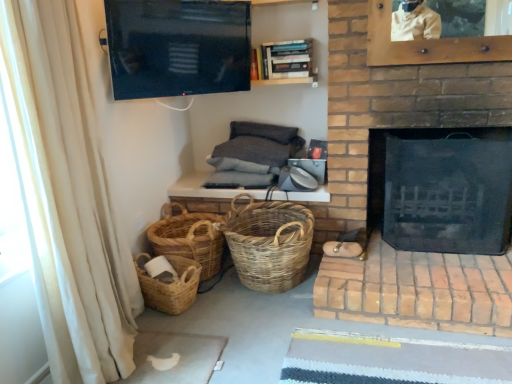
The height and width of the screenshot is (384, 512). I want to click on reddish-brown brick at right, so tap(418, 290).

This screenshot has height=384, width=512. What are the coordinates of `black mesh fireplace at right` in the screenshot? It's located at (442, 189).

This screenshot has width=512, height=384. I want to click on woven natural baskets at lower left, the second basket from the right, so click(189, 237).

Is flat-screen tv at upper center outside of woven natural baskets at lower left, marked as the second basket in a left-to-right arrangement?

Indeed, flat-screen tv at upper center is completely outside woven natural baskets at lower left, marked as the second basket in a left-to-right arrangement.

Which object is wider, flat-screen tv at upper center or woven natural baskets at lower left, marked as the second basket in a left-to-right arrangement?

woven natural baskets at lower left, marked as the second basket in a left-to-right arrangement.

Based on the photo, how far apart are flat-screen tv at upper center and woven natural baskets at lower left, the second basket from the right?

The distance of flat-screen tv at upper center from woven natural baskets at lower left, the second basket from the right, is 35.26 inches.

Who is more distant, flat-screen tv at upper center or woven natural baskets at lower left, marked as the second basket in a left-to-right arrangement?

woven natural baskets at lower left, marked as the second basket in a left-to-right arrangement.

Choose the correct answer: Is black mesh fireplace at right inside beige fabric curtain at left or outside it?

black mesh fireplace at right lies outside beige fabric curtain at left.

Does black mesh fireplace at right appear on the right side of beige fabric curtain at left?

Correct, you'll find black mesh fireplace at right to the right of beige fabric curtain at left.

From a real-world perspective, is black mesh fireplace at right physically located above or below beige fabric curtain at left?

Clearly, from a real-world perspective, black mesh fireplace at right is below beige fabric curtain at left.

Is black mesh fireplace at right turned away from beige fabric curtain at left?

No, black mesh fireplace at right is not facing the opposite direction of beige fabric curtain at left.

Does flat-screen tv at upper center appear on the right side of black mesh fireplace at right?

No, flat-screen tv at upper center is not to the right of black mesh fireplace at right.

From the image's perspective, does flat-screen tv at upper center appear higher than black mesh fireplace at right?

Yes.

Measure the distance between flat-screen tv at upper center and black mesh fireplace at right.

flat-screen tv at upper center is 3.74 feet from black mesh fireplace at right.

Between flat-screen tv at upper center and black mesh fireplace at right, which one has less height?

With less height is flat-screen tv at upper center.

This screenshot has width=512, height=384. There is a woven natural baskets at lower left, the second basket from the right. What are the coordinates of `shelf above it (from a real-world perspective)` in the screenshot? It's located at (285, 63).

Consider the image. Considering the sizes of wooden bookshelf at upper center and woven natural baskets at lower left, marked as the second basket in a left-to-right arrangement, in the image, is wooden bookshelf at upper center bigger or smaller than woven natural baskets at lower left, marked as the second basket in a left-to-right arrangement,?

Clearly, wooden bookshelf at upper center is smaller in size than woven natural baskets at lower left, marked as the second basket in a left-to-right arrangement.

From the image's perspective, is wooden bookshelf at upper center below woven natural baskets at lower left, the second basket from the right?

Actually, wooden bookshelf at upper center appears above woven natural baskets at lower left, the second basket from the right, in the image.

Between wooden bookshelf at upper center and woven natural baskets at lower left, marked as the second basket in a left-to-right arrangement, which one appears on the left side from the viewer's perspective?

From the viewer's perspective, woven natural baskets at lower left, marked as the second basket in a left-to-right arrangement, appears more on the left side.

Based on the photo, which of these two, black mesh fireplace at right or reddish-brown brick at right, stands shorter?

reddish-brown brick at right.

From a real-world perspective, is black mesh fireplace at right on top of reddish-brown brick at right?

Indeed, from a real-world perspective, black mesh fireplace at right stands above reddish-brown brick at right.

Is black mesh fireplace at right turned away from reddish-brown brick at right?

No.

In the scene shown: Between flat-screen tv at upper center and wooden bookshelf at upper center, which one has smaller width?

Thinner between the two is flat-screen tv at upper center.

Is wooden bookshelf at upper center surrounded by flat-screen tv at upper center?

No, wooden bookshelf at upper center is not inside flat-screen tv at upper center.

Who is bigger, flat-screen tv at upper center or wooden bookshelf at upper center?

flat-screen tv at upper center is bigger.

How far apart are flat-screen tv at upper center and wooden bookshelf at upper center?

flat-screen tv at upper center is 48.48 centimeters away from wooden bookshelf at upper center.

Which of these two, black mesh fireplace at right or woven natural basket at lower left, the first basket positioned from the left, stands taller?

With more height is black mesh fireplace at right.

Could you tell me if black mesh fireplace at right is turned towards woven natural basket at lower left, the first basket positioned from the left?

No, black mesh fireplace at right is not turned towards woven natural basket at lower left, the first basket positioned from the left.

This screenshot has height=384, width=512. In order to click on basket that is the 3rd object directly below the black mesh fireplace at right (from a real-world perspective) in this screenshot , I will do `click(169, 285)`.

Identify the location of the 1st basket to the left when counting from the flat-screen tv at upper center. The height and width of the screenshot is (384, 512). (189, 237).

This screenshot has width=512, height=384. I want to click on fireplace beneath the beige fabric curtain at left (from a real-world perspective), so click(x=442, y=189).

Based on their spatial positions, is black mesh fireplace at right or beige fabric curtain at left closer to woven natural basket at center, placed as the first basket when sorted from right to left?

black mesh fireplace at right lies closer to woven natural basket at center, placed as the first basket when sorted from right to left, than the other object.

Estimate the real-world distances between objects in this image. Which object is further from woven natural baskets at lower left, marked as the second basket in a left-to-right arrangement, woven natural basket at center, which appears as the 3th basket when viewed from the left, or flat-screen tv at upper center?

flat-screen tv at upper center is positioned further to the anchor woven natural baskets at lower left, marked as the second basket in a left-to-right arrangement.

Estimate the real-world distances between objects in this image. Which object is further from woven natural basket at lower left, positioned as the third basket in right-to-left order, reddish-brown brick at right or beige fabric curtain at left?

reddish-brown brick at right is further to woven natural basket at lower left, positioned as the third basket in right-to-left order.

When comparing their distances from wooden bookshelf at upper center, does woven natural basket at center, placed as the first basket when sorted from right to left, or reddish-brown brick at right seem closer?

woven natural basket at center, placed as the first basket when sorted from right to left, is positioned closer to the anchor wooden bookshelf at upper center.

Looking at the image, which one is located further to woven natural basket at lower left, positioned as the third basket in right-to-left order, reddish-brown brick at right or woven natural baskets at lower left, marked as the second basket in a left-to-right arrangement?

reddish-brown brick at right.

Looking at the image, which one is located closer to black mesh fireplace at right, woven natural baskets at lower left, marked as the second basket in a left-to-right arrangement, or beige fabric curtain at left?

woven natural baskets at lower left, marked as the second basket in a left-to-right arrangement, lies closer to black mesh fireplace at right than the other object.

Looking at the image, which one is located further to flat-screen tv at upper center, woven natural basket at center, placed as the first basket when sorted from right to left, or beige fabric curtain at left?

The object further to flat-screen tv at upper center is woven natural basket at center, placed as the first basket when sorted from right to left.

Which object lies further to the anchor point beige fabric curtain at left, woven natural baskets at lower left, marked as the second basket in a left-to-right arrangement, or woven natural basket at center, placed as the first basket when sorted from right to left?

woven natural basket at center, placed as the first basket when sorted from right to left, lies further to beige fabric curtain at left than the other object.

Image resolution: width=512 pixels, height=384 pixels. Find the location of `shelf between woven natural basket at lower left, positioned as the third basket in right-to-left order, and black mesh fireplace at right, in the horizontal direction`. shelf between woven natural basket at lower left, positioned as the third basket in right-to-left order, and black mesh fireplace at right, in the horizontal direction is located at coordinates (285, 63).

Find the location of `fireplace between wooden bookshelf at upper center and woven natural basket at center, placed as the first basket when sorted from right to left, in the up-down direction`. fireplace between wooden bookshelf at upper center and woven natural basket at center, placed as the first basket when sorted from right to left, in the up-down direction is located at coordinates (442, 189).

Identify the location of basket situated between flat-screen tv at upper center and reddish-brown brick at right from left to right. (269, 243).

You are a GUI agent. You are given a task and a screenshot of the screen. Output one action in this format:
    pyautogui.click(x=<x>, y=<y>)
    Task: Click on the basket between flat-screen tv at upper center and woven natural baskets at lower left, marked as the second basket in a left-to-right arrangement, from top to bottom
    
    Given the screenshot: What is the action you would take?
    pyautogui.click(x=269, y=243)